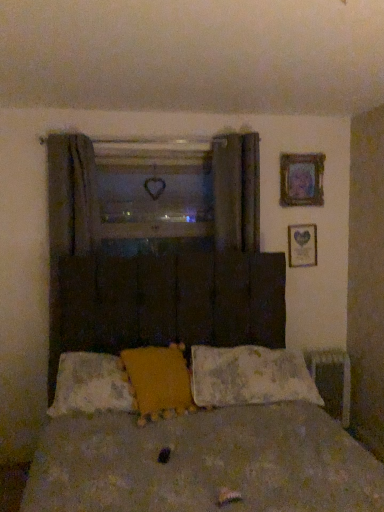
Question: Does metallic gray radiator at lower right have a greater width compared to fluffy white pillow at center, which appears as the 3th pillow when viewed from the left?

Choices:
 (A) no
 (B) yes

Answer: (A)

Question: Is metallic gray radiator at lower right beside fluffy white pillow at center, which appears as the 3th pillow when viewed from the left?

Choices:
 (A) yes
 (B) no

Answer: (B)

Question: From a real-world perspective, is metallic gray radiator at lower right located beneath fluffy white pillow at center, acting as the first pillow starting from the right?

Choices:
 (A) yes
 (B) no

Answer: (A)

Question: Is metallic gray radiator at lower right shorter than fluffy white pillow at center, which appears as the 3th pillow when viewed from the left?

Choices:
 (A) yes
 (B) no

Answer: (B)

Question: Does metallic gray radiator at lower right have a greater height compared to fluffy white pillow at center, which appears as the 3th pillow when viewed from the left?

Choices:
 (A) yes
 (B) no

Answer: (A)

Question: From the image's perspective, is metallic gray radiator at lower right above fluffy white pillow at center, acting as the first pillow starting from the right?

Choices:
 (A) no
 (B) yes

Answer: (A)

Question: Can you confirm if metallic gray radiator at lower right is bigger than dark gray fabric curtain at left, the 1th curtain positioned from the left?

Choices:
 (A) no
 (B) yes

Answer: (A)

Question: Considering the relative positions of metallic gray radiator at lower right and dark gray fabric curtain at left, the 1th curtain positioned from the left, in the image provided, is metallic gray radiator at lower right to the left of dark gray fabric curtain at left, the 1th curtain positioned from the left, from the viewer's perspective?

Choices:
 (A) yes
 (B) no

Answer: (B)

Question: Considering the relative positions of metallic gray radiator at lower right and dark gray fabric curtain at left, which ranks as the 2th curtain in right-to-left order, in the image provided, is metallic gray radiator at lower right in front of dark gray fabric curtain at left, which ranks as the 2th curtain in right-to-left order,?

Choices:
 (A) no
 (B) yes

Answer: (A)

Question: Is the position of metallic gray radiator at lower right more distant than that of dark gray fabric curtain at left, the 1th curtain positioned from the left?

Choices:
 (A) no
 (B) yes

Answer: (B)

Question: Can you confirm if metallic gray radiator at lower right is taller than dark gray fabric curtain at left, the 1th curtain positioned from the left?

Choices:
 (A) no
 (B) yes

Answer: (A)

Question: Is metallic gray radiator at lower right oriented away from dark gray fabric curtain at left, the 1th curtain positioned from the left?

Choices:
 (A) no
 (B) yes

Answer: (A)

Question: Can you confirm if dark gray fabric curtain at left, the 1th curtain positioned from the left, is smaller than fluffy white pillow at center, acting as the 3th pillow starting from the right?

Choices:
 (A) no
 (B) yes

Answer: (A)